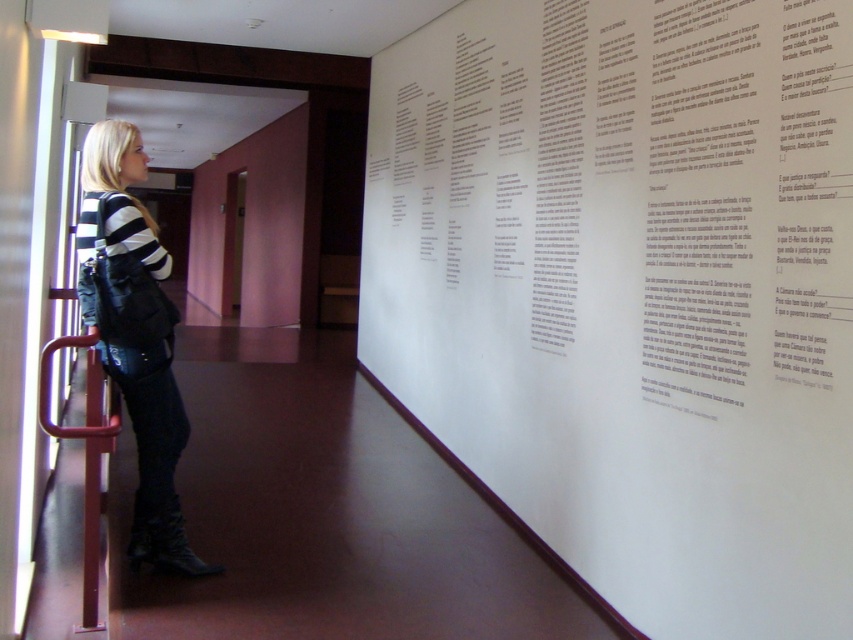
Question: Is white paper at upper center bigger than metallic red handrail at lower left?

Choices:
 (A) yes
 (B) no

Answer: (A)

Question: Which point appears farthest from the camera in this image?

Choices:
 (A) (758, 570)
 (B) (96, 444)

Answer: (B)

Question: Estimate the real-world distances between objects in this image. Which object is closer to the white paper at upper center?

Choices:
 (A) metallic red handrail at lower left
 (B) black leather boots at lower left

Answer: (B)

Question: Where is white paper at upper center located in relation to metallic red handrail at lower left in the image?

Choices:
 (A) above
 (B) below

Answer: (A)

Question: Based on their relative distances, which object is farther from the white paper at upper center?

Choices:
 (A) black leather boots at lower left
 (B) metallic red handrail at lower left

Answer: (B)

Question: From the image, what is the correct spatial relationship of white paper at upper center in relation to black leather boots at lower left?

Choices:
 (A) above
 (B) below

Answer: (A)